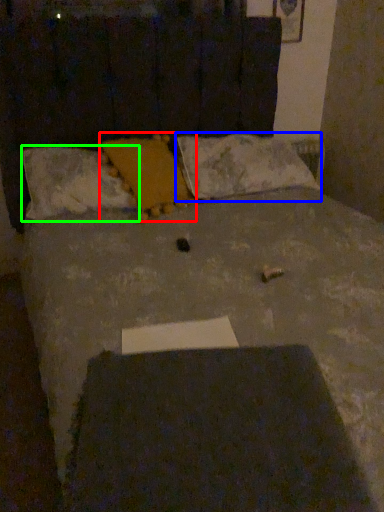
Question: Based on their relative distances, which object is farther from pillow (highlighted by a red box)? Choose from pillow (highlighted by a blue box) and pillow (highlighted by a green box).

Choices:
 (A) pillow
 (B) pillow

Answer: (A)